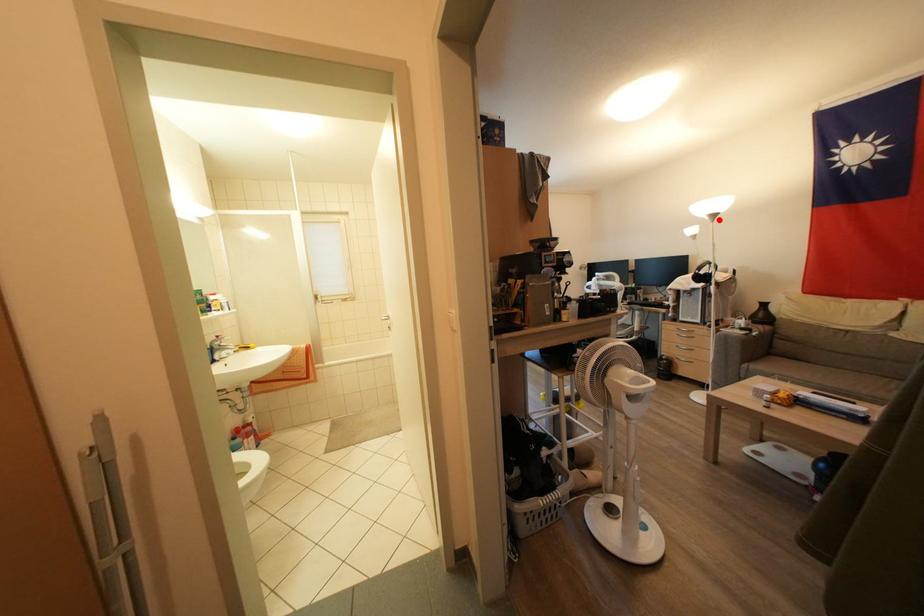
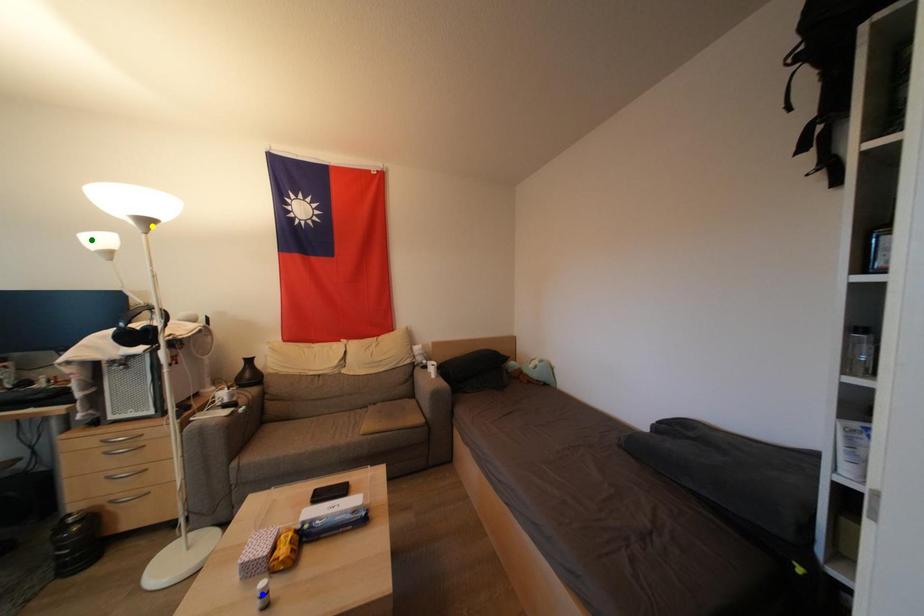
Question: I am providing you with two images of the same scene from different viewpoints. A red point is marked on the first image. You are given multiple points on the second image. Which mark in image 2 goes with the point in image 1?

Choices:
 (A) yellow point
 (B) green point
 (C) blue point

Answer: (A)